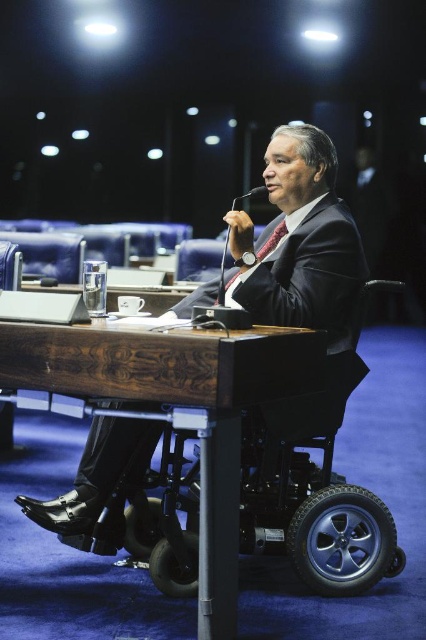
Question: Does matte black suit at center have a larger size compared to red silk tie at center?

Choices:
 (A) no
 (B) yes

Answer: (B)

Question: Which point is farther to the camera?

Choices:
 (A) (239, 196)
 (B) (244, 305)

Answer: (B)

Question: Among these points, which one is farthest from the camera?

Choices:
 (A) (325, 282)
 (B) (187, 352)

Answer: (A)

Question: Does wooden table at center appear under black plastic microphone at center?

Choices:
 (A) no
 (B) yes

Answer: (B)

Question: Among these objects, which one is nearest to the camera?

Choices:
 (A) wooden table at center
 (B) red silk tie at center
 (C) matte black suit at center
 (D) black plastic microphone at center

Answer: (A)

Question: In this image, where is matte black suit at center located relative to black plastic microphone at center?

Choices:
 (A) above
 (B) below

Answer: (B)